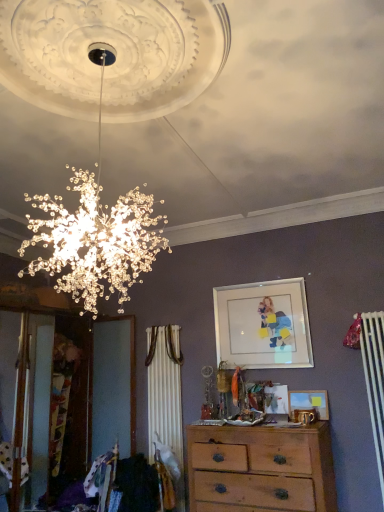
Question: Can you confirm if matte wooden picture frame at center, acting as the 2th picture frame starting from the top, is positioned to the right of matte glass picture frame at upper center, which is the first picture frame from top to bottom?

Choices:
 (A) yes
 (B) no

Answer: (A)

Question: Are matte wooden picture frame at center, placed as the first picture frame when sorted from bottom to top, and matte glass picture frame at upper center, which is the second picture frame from bottom to top, making contact?

Choices:
 (A) no
 (B) yes

Answer: (A)

Question: From the image's perspective, does matte wooden picture frame at center, placed as the first picture frame when sorted from bottom to top, appear higher than matte glass picture frame at upper center, which is the second picture frame from bottom to top?

Choices:
 (A) no
 (B) yes

Answer: (A)

Question: Is matte wooden picture frame at center, acting as the 2th picture frame starting from the top, bigger than matte glass picture frame at upper center, which is the first picture frame from top to bottom?

Choices:
 (A) yes
 (B) no

Answer: (B)

Question: Is matte wooden picture frame at center, placed as the first picture frame when sorted from bottom to top, aimed at matte glass picture frame at upper center, which is the first picture frame from top to bottom?

Choices:
 (A) yes
 (B) no

Answer: (B)

Question: Is matte glass picture frame at upper center, which is the first picture frame from top to bottom, surrounded by matte wooden picture frame at center, acting as the 2th picture frame starting from the top?

Choices:
 (A) yes
 (B) no

Answer: (B)

Question: Is wooden chest of drawers at center to the left of matte wooden picture frame at center, placed as the first picture frame when sorted from bottom to top, from the viewer's perspective?

Choices:
 (A) yes
 (B) no

Answer: (A)

Question: Is wooden chest of drawers at center wider than matte wooden picture frame at center, placed as the first picture frame when sorted from bottom to top?

Choices:
 (A) yes
 (B) no

Answer: (A)

Question: Can you confirm if wooden chest of drawers at center is smaller than matte wooden picture frame at center, placed as the first picture frame when sorted from bottom to top?

Choices:
 (A) yes
 (B) no

Answer: (B)

Question: From a real-world perspective, does wooden chest of drawers at center stand above matte wooden picture frame at center, placed as the first picture frame when sorted from bottom to top?

Choices:
 (A) no
 (B) yes

Answer: (A)

Question: From the image's perspective, is wooden chest of drawers at center beneath matte wooden picture frame at center, acting as the 2th picture frame starting from the top?

Choices:
 (A) no
 (B) yes

Answer: (B)

Question: Does wooden chest of drawers at center turn towards matte wooden picture frame at center, placed as the first picture frame when sorted from bottom to top?

Choices:
 (A) yes
 (B) no

Answer: (B)

Question: From a real-world perspective, does wooden chest of drawers at center sit lower than matte glass picture frame at upper center, which is the first picture frame from top to bottom?

Choices:
 (A) no
 (B) yes

Answer: (B)